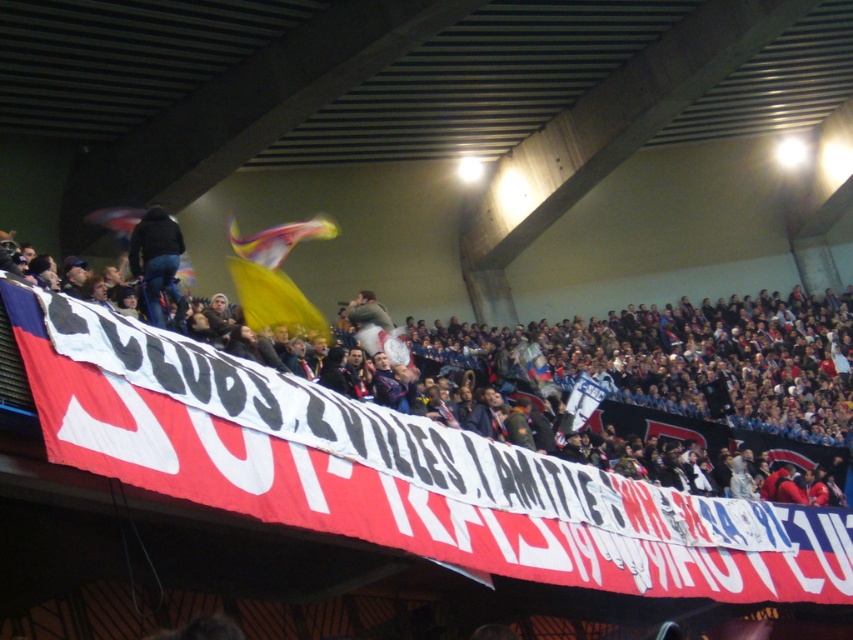
Question: Is the position of red fabric banner at center less distant than that of dark blue jeans at center?

Choices:
 (A) no
 (B) yes

Answer: (B)

Question: Can you confirm if red fabric banner at center is positioned above dark blue jeans at center?

Choices:
 (A) no
 (B) yes

Answer: (A)

Question: Which object is farther from the camera taking this photo?

Choices:
 (A) dark blue jeans at center
 (B) red fabric banner at center

Answer: (A)

Question: Which point appears farthest from the camera in this image?

Choices:
 (A) (170, 224)
 (B) (380, 412)

Answer: (A)

Question: Which of the following is the farthest from the observer?

Choices:
 (A) dark blue jeans at center
 (B) red fabric banner at center

Answer: (A)

Question: Can you confirm if red fabric banner at center is bigger than dark blue jeans at center?

Choices:
 (A) yes
 (B) no

Answer: (A)